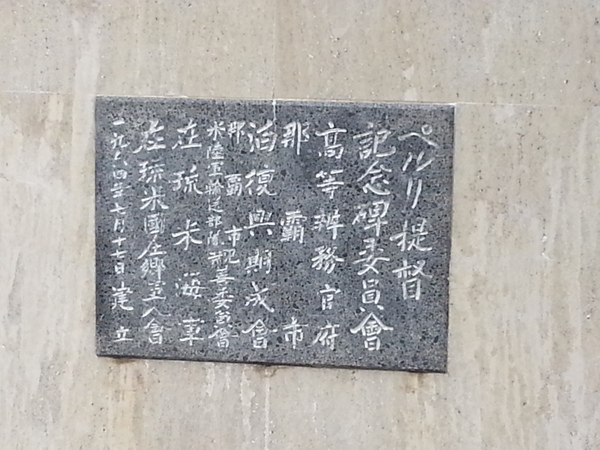
Where is `white grout`? The width and height of the screenshot is (600, 450). white grout is located at coordinates (270, 432).